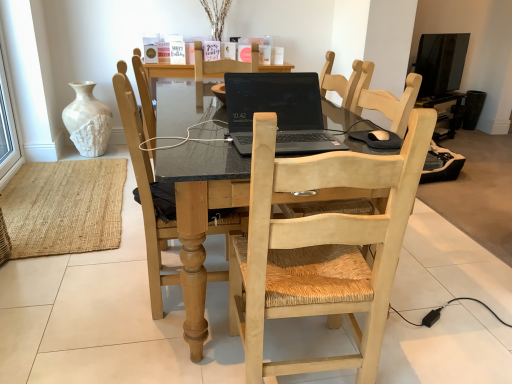
Locate an element on the screen. This screenshot has height=384, width=512. free spot to the left of light wood woven seat at center, the 2th chair in the left-to-right sequence is located at coordinates (186, 355).